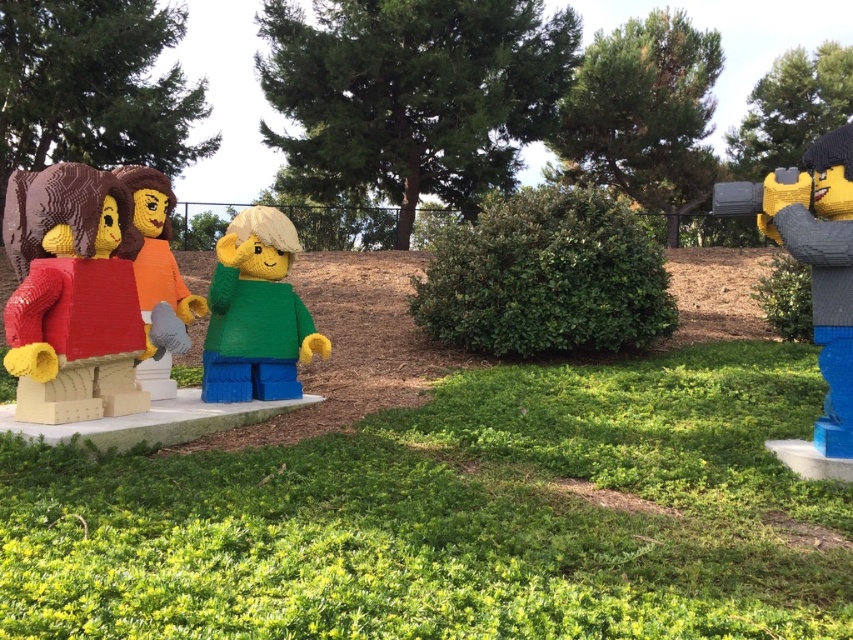
Which of these two, matte red brick at left or green matte lego figure at center, stands shorter?

green matte lego figure at center

Does matte red brick at left appear over green matte lego figure at center?

Yes.

Between point (74, 298) and point (254, 301), which one is positioned behind?

The point (254, 301) is behind.

You are a GUI agent. You are given a task and a screenshot of the screen. Output one action in this format:
    pyautogui.click(x=<x>, y=<y>)
    Task: Click on the matte red brick at left
    
    Given the screenshot: What is the action you would take?
    pyautogui.click(x=71, y=294)

Who is shorter, textured brown bear at left or brown woolen sweater at center?

With less height is textured brown bear at left.

How distant is textured brown bear at left from brown woolen sweater at center?

textured brown bear at left is 54.23 centimeters from brown woolen sweater at center.

Between point (9, 221) and point (140, 300), which one is positioned behind?

The point (140, 300) is behind.

At what (x,y) coordinates should I click in order to perform the action: click on textured brown bear at left. Please return your answer as a coordinate pair (x, y). The height and width of the screenshot is (640, 853). Looking at the image, I should click on (62, 211).

Who is positioned more to the right, green leafy bush at center or textured brown bear at left?

green leafy bush at center is more to the right.

This screenshot has height=640, width=853. Find the location of `green leafy bush at center`. green leafy bush at center is located at coordinates (544, 276).

The width and height of the screenshot is (853, 640). In order to click on green leafy bush at center in this screenshot , I will do `click(544, 276)`.